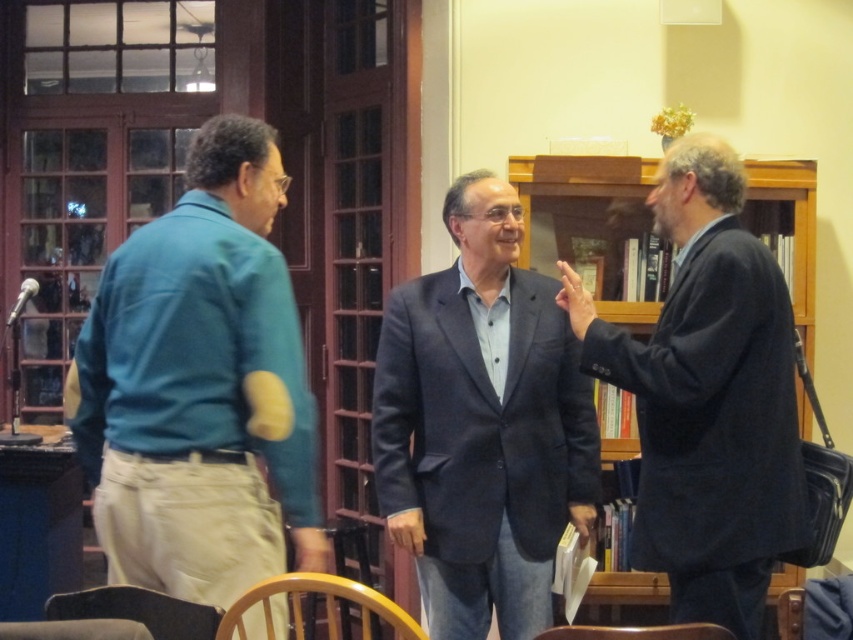
Question: Is wooden chair at lower center above dark brown leather chair at lower left?

Choices:
 (A) yes
 (B) no

Answer: (B)

Question: Can you confirm if dark brown leather chair at lower left is positioned to the right of matte black hand at center?

Choices:
 (A) yes
 (B) no

Answer: (B)

Question: Which of the following is the closest to the observer?

Choices:
 (A) (0, 634)
 (B) (564, 520)
 (C) (90, 468)

Answer: (A)

Question: Among these points, which one is farthest from the camera?

Choices:
 (A) (766, 563)
 (B) (543, 637)

Answer: (A)

Question: Based on their relative distances, which object is farther from the dark blue suit at center?

Choices:
 (A) teal fabric shirt at left
 (B) matte black hand at center
 (C) dark brown leather chair at lower left

Answer: (C)

Question: Can you confirm if dark blue suit at right is smaller than wooden chair at lower center?

Choices:
 (A) no
 (B) yes

Answer: (A)